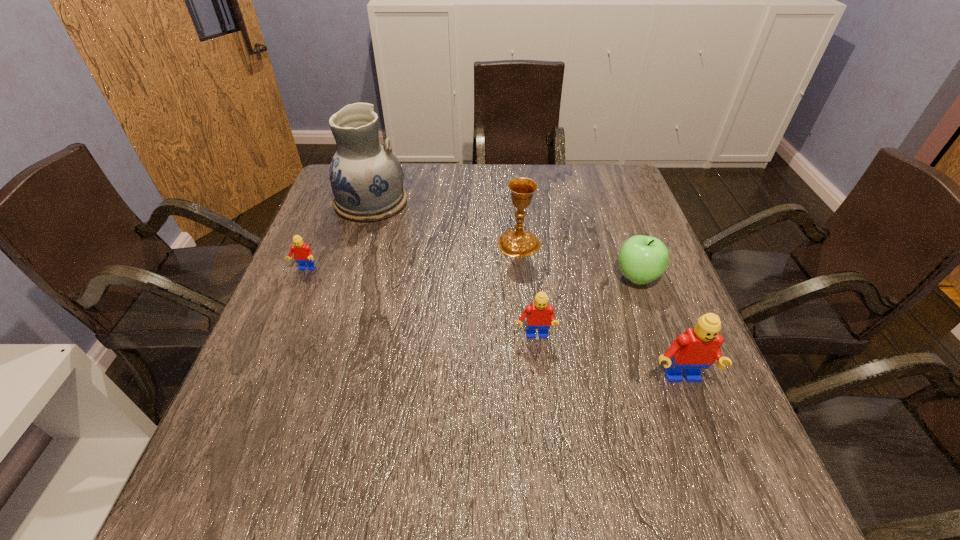
Find the location of `apple present at the right edge`. apple present at the right edge is located at coordinates (642, 259).

Where is `object positioned at the far left corner`? object positioned at the far left corner is located at coordinates (366, 177).

Where is `vacant area at the far edge`? Image resolution: width=960 pixels, height=540 pixels. vacant area at the far edge is located at coordinates (479, 197).

In order to click on free space at the near edge of the desktop in this screenshot , I will do `click(464, 442)`.

Find the location of a particular element. This screenshot has height=540, width=960. vacant space at the left edge of the desktop is located at coordinates (324, 387).

The height and width of the screenshot is (540, 960). What are the coordinates of `blank space at the right edge of the desktop` in the screenshot? It's located at (631, 228).

You are a GUI agent. You are given a task and a screenshot of the screen. Output one action in this format:
    pyautogui.click(x=<x>, y=<y>)
    Task: Click on the free space at the far left corner of the desktop
    
    Given the screenshot: What is the action you would take?
    pyautogui.click(x=331, y=206)

The width and height of the screenshot is (960, 540). I want to click on vacant space at the far right corner of the desktop, so click(597, 169).

In the image, there is a desktop. Identify the location of vacant space at the near right corner. This screenshot has width=960, height=540. (676, 430).

This screenshot has width=960, height=540. Find the location of `free spot between the fifth farthest object and the apple`. free spot between the fifth farthest object and the apple is located at coordinates (586, 307).